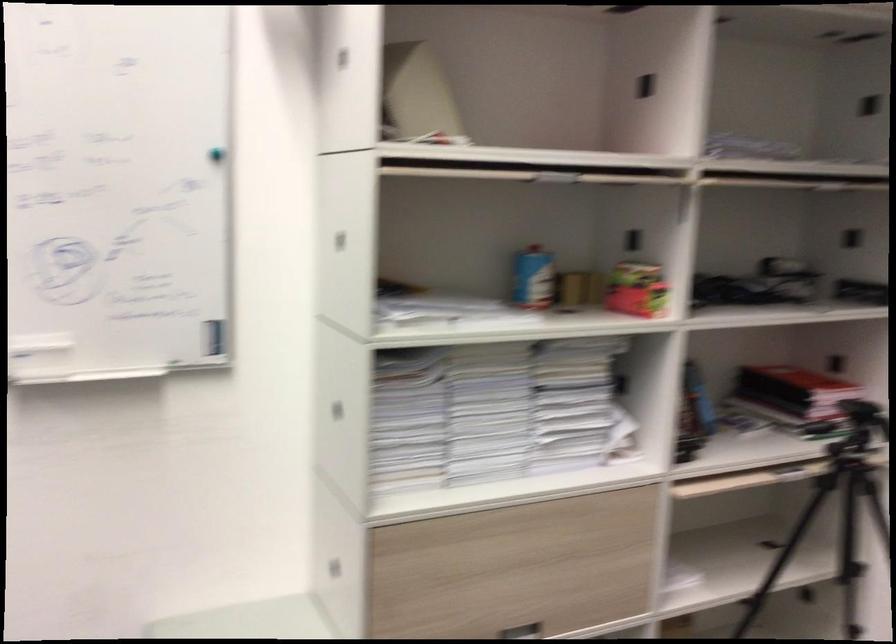
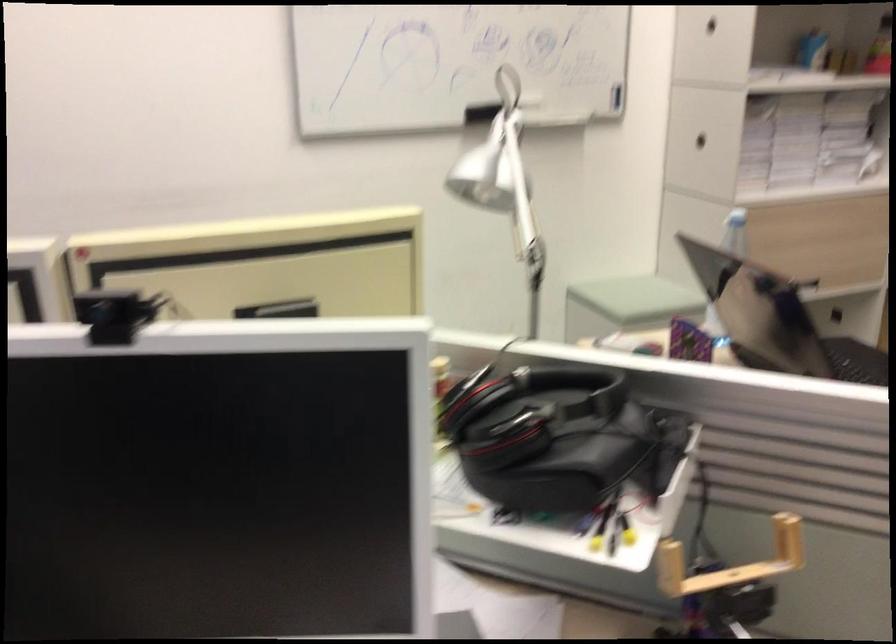
Find the pixel in the second image that matches pixel 332 247 in the first image.

(711, 24)